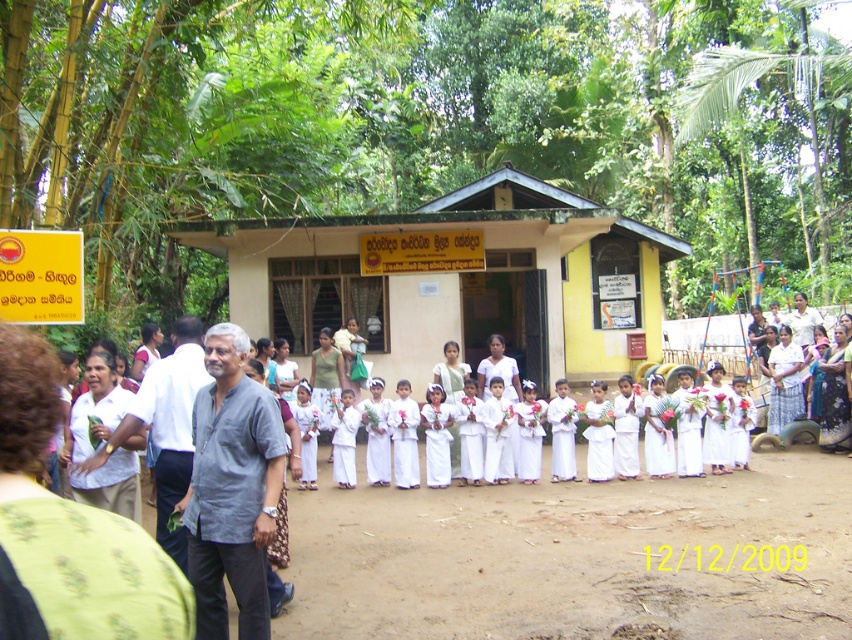
Question: Can you confirm if beige painted wood hut at center is smaller than white cloth at center?

Choices:
 (A) yes
 (B) no

Answer: (B)

Question: Among these objects, which one is farthest from the camera?

Choices:
 (A) light gray shirt at left
 (B) beige painted wood hut at center
 (C) white cloth at center

Answer: (B)

Question: Where is beige painted wood hut at center located in relation to gray cotton shirt at center in the image?

Choices:
 (A) below
 (B) above

Answer: (B)

Question: Can you confirm if white matte shirt at left is positioned below white cloth at center?

Choices:
 (A) yes
 (B) no

Answer: (B)

Question: Which point is farther to the camera?

Choices:
 (A) white matte shirt at left
 (B) beige painted wood hut at center
 (C) light gray shirt at left

Answer: (B)

Question: Estimate the real-world distances between objects in this image. Which object is closer to the light gray shirt at left?

Choices:
 (A) white cloth at center
 (B) beige painted wood hut at center
 (C) white matte shirt at left

Answer: (C)